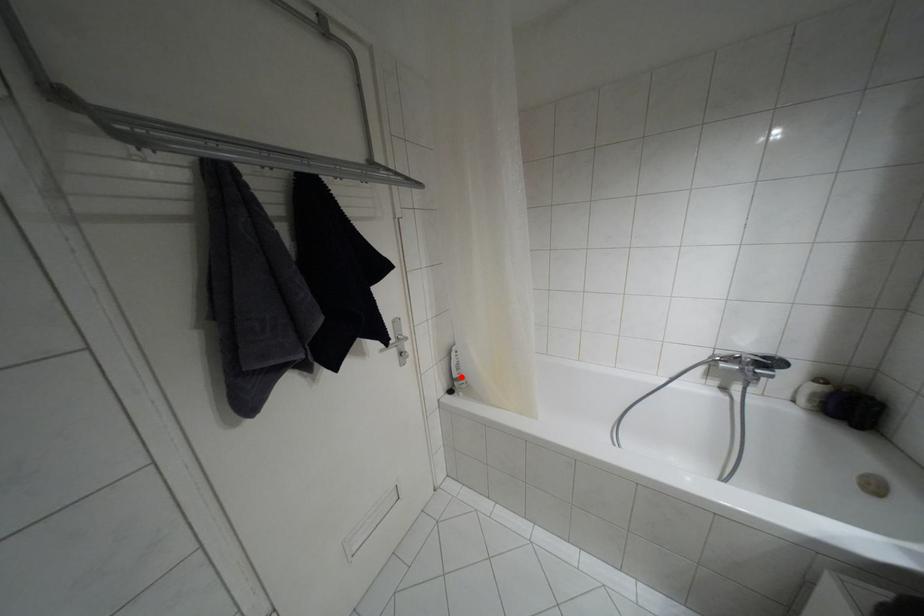
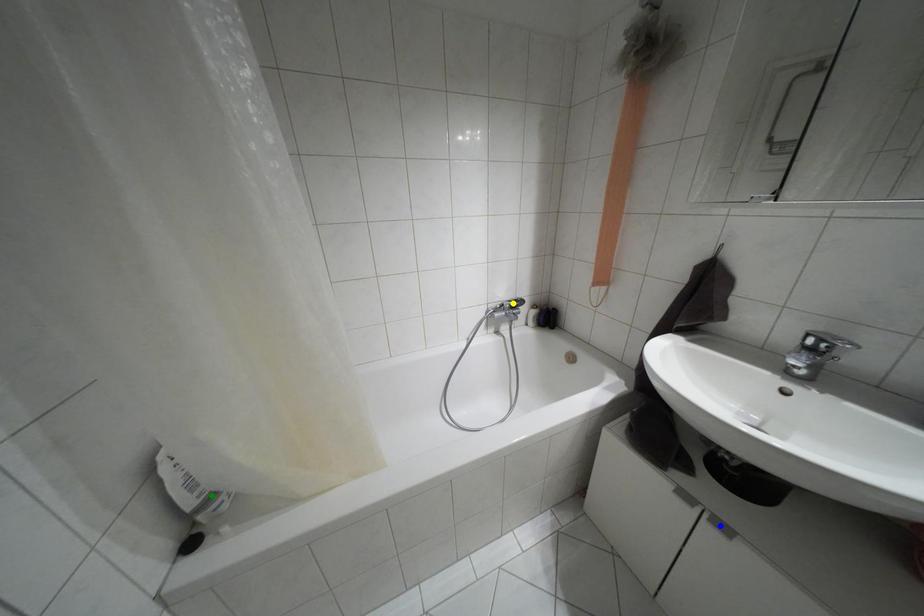
Question: I am providing you with two images of the same scene from different viewpoints. A red point is marked on the first image. You are given multiple points on the second image. Which point in image 2 is actually the same real-world point as the red point in image 1?

Choices:
 (A) yellow point
 (B) blue point
 (C) green point

Answer: (C)